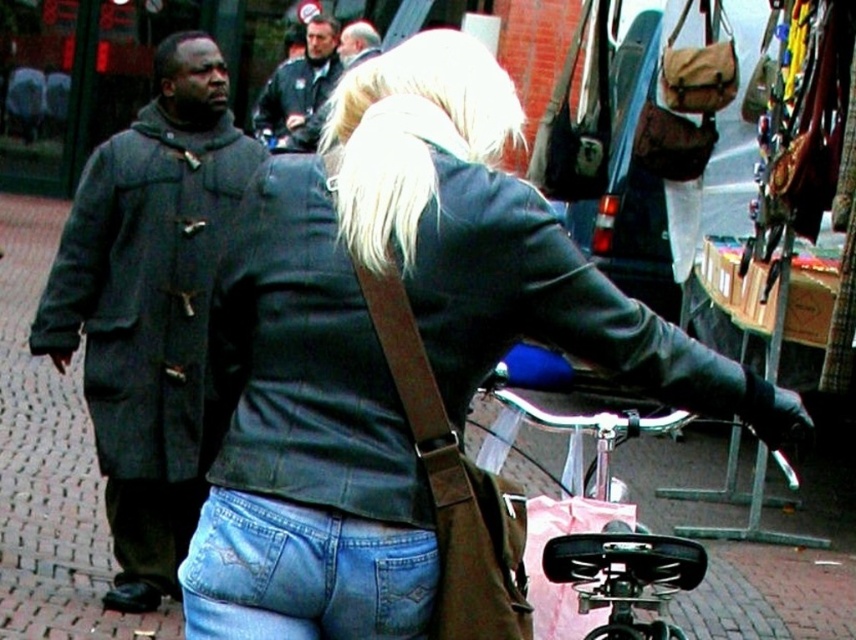
Question: Which point appears farthest from the camera in this image?

Choices:
 (A) (515, 362)
 (B) (497, 563)
 (C) (296, 83)

Answer: (C)

Question: Does dark gray wool trench coat at left have a smaller size compared to shiny black bicycle at center?

Choices:
 (A) yes
 (B) no

Answer: (B)

Question: Considering the relative positions of matte black jacket at center and dark gray wool trench coat at left in the image provided, where is matte black jacket at center located with respect to dark gray wool trench coat at left?

Choices:
 (A) above
 (B) below

Answer: (B)

Question: Can you confirm if dark gray wool trench coat at left is bigger than denim jeans at lower center?

Choices:
 (A) yes
 (B) no

Answer: (A)

Question: Based on their relative distances, which object is farther from the denim jeans at lower center?

Choices:
 (A) brown leather bag at center
 (B) shiny black bicycle at center
 (C) dark gray wool trench coat at left

Answer: (C)

Question: Which point is closer to the camera?

Choices:
 (A) (346, 422)
 (B) (168, 172)
 (C) (619, 518)

Answer: (A)